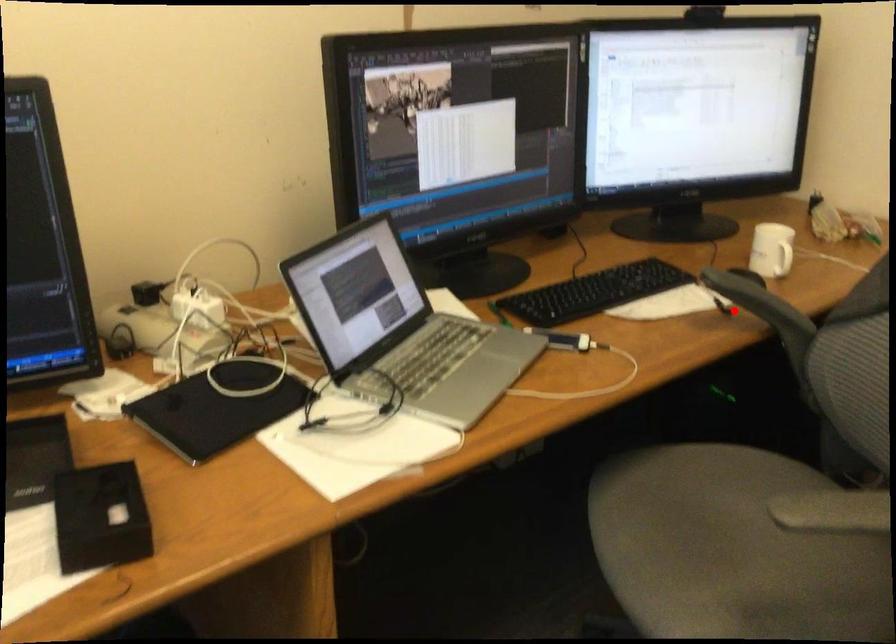
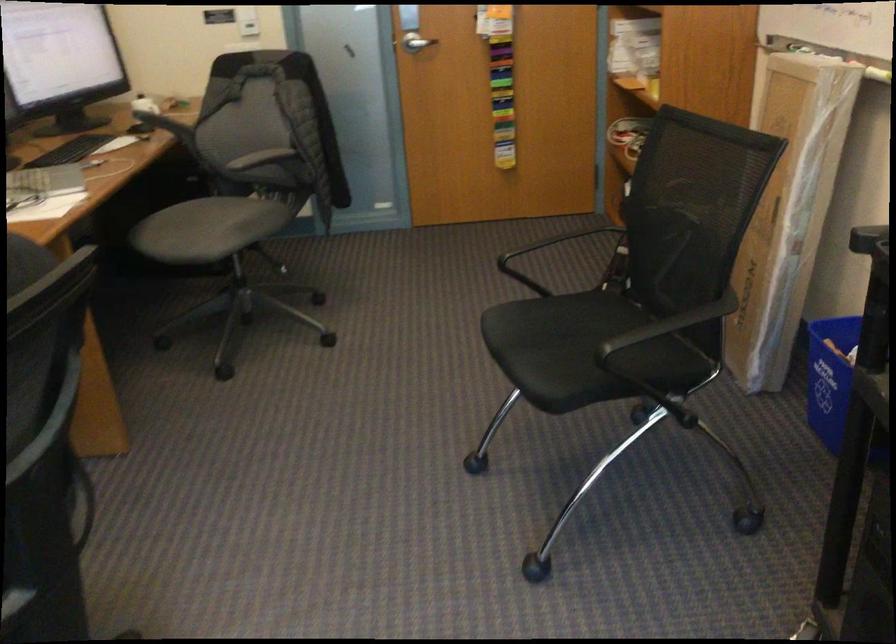
Question: I am providing you with two images of the same scene from different viewpoints. Image1 has a red point marked. In image2, the corresponding 3D location appears at what relative position? Reply with the corresponding letter.

Choices:
 (A) Closer
 (B) Farther

Answer: (B)